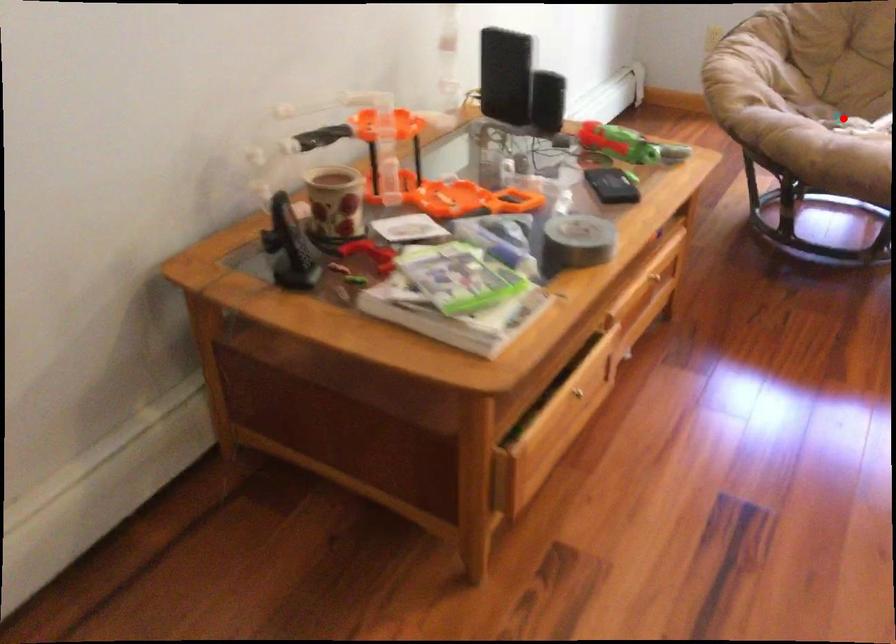
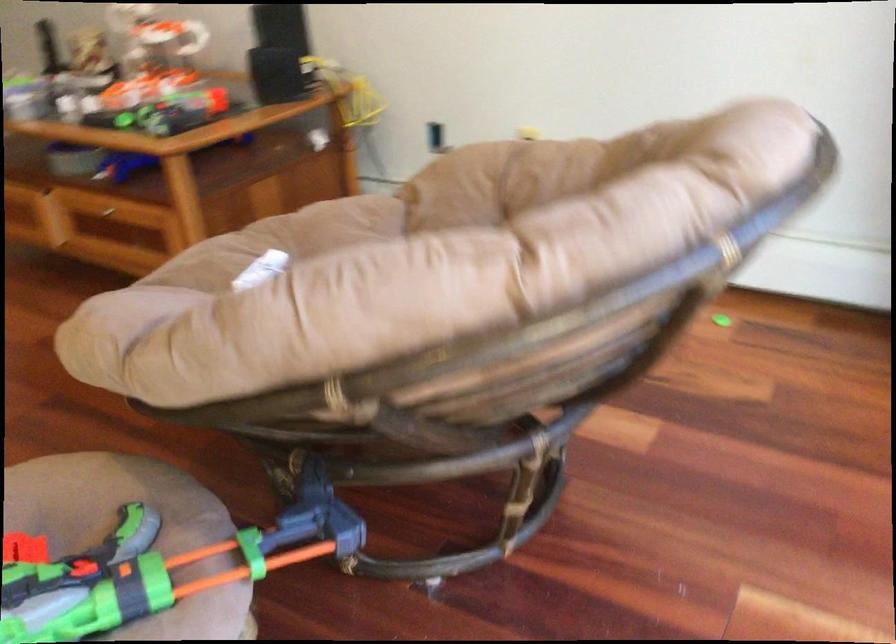
Question: I am providing you with two images of the same scene from different viewpoints. A red point is marked on the first image. Is the red point's position out of view in image 2?

Choices:
 (A) Yes
 (B) No

Answer: (A)